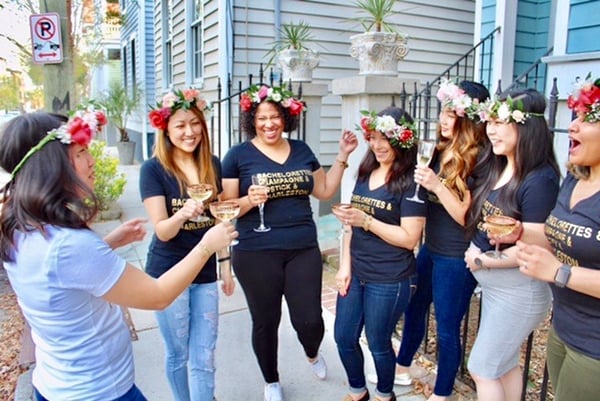
Find the location of a particular element. The image size is (600, 401). plants in white planters is located at coordinates pyautogui.click(x=375, y=11), pyautogui.click(x=279, y=43).